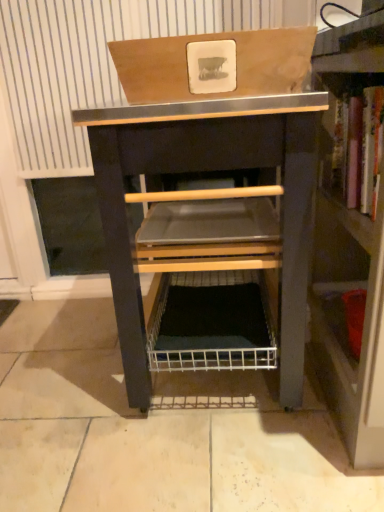
Question: Is wooden box at upper center shorter than wooden bookshelf at right?

Choices:
 (A) yes
 (B) no

Answer: (A)

Question: Is wooden bookshelf at right located within wooden box at upper center?

Choices:
 (A) yes
 (B) no

Answer: (B)

Question: Can you confirm if wooden box at upper center is taller than wooden bookshelf at right?

Choices:
 (A) no
 (B) yes

Answer: (A)

Question: Is wooden box at upper center looking in the opposite direction of wooden bookshelf at right?

Choices:
 (A) yes
 (B) no

Answer: (A)

Question: Is wooden box at upper center positioned beyond the bounds of wooden bookshelf at right?

Choices:
 (A) yes
 (B) no

Answer: (A)

Question: Does wooden box at upper center lie behind wooden bookshelf at right?

Choices:
 (A) yes
 (B) no

Answer: (A)

Question: Is wooden bookshelf at right thinner than black metal/wooden vanity at center?

Choices:
 (A) yes
 (B) no

Answer: (A)

Question: From the image's perspective, would you say wooden bookshelf at right is shown under black metal/wooden vanity at center?

Choices:
 (A) yes
 (B) no

Answer: (A)

Question: Is wooden bookshelf at right looking in the opposite direction of black metal/wooden vanity at center?

Choices:
 (A) yes
 (B) no

Answer: (B)

Question: Is wooden bookshelf at right further to the viewer compared to black metal/wooden vanity at center?

Choices:
 (A) no
 (B) yes

Answer: (A)

Question: Can you confirm if wooden bookshelf at right is positioned to the left of black metal/wooden vanity at center?

Choices:
 (A) yes
 (B) no

Answer: (B)

Question: Is wooden bookshelf at right bigger than black metal/wooden vanity at center?

Choices:
 (A) no
 (B) yes

Answer: (A)

Question: Is black metal/wooden vanity at center positioned behind wooden box at upper center?

Choices:
 (A) no
 (B) yes

Answer: (B)